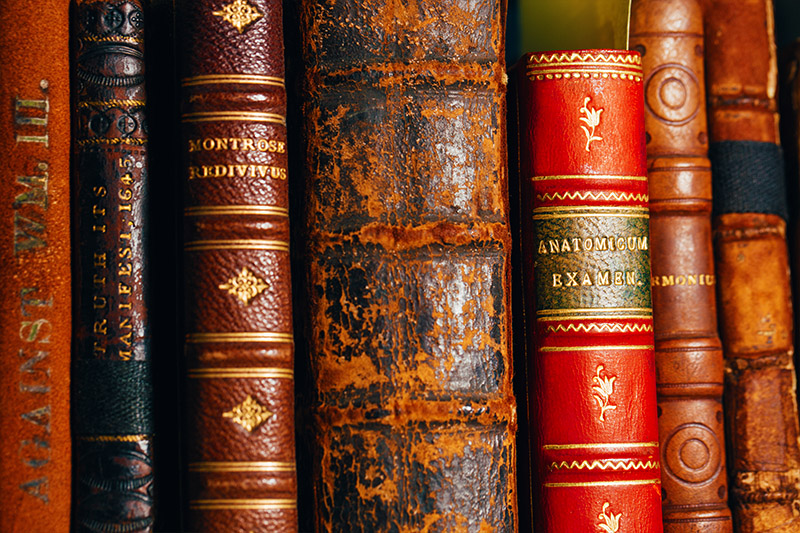
You are a GUI agent. You are given a task and a screenshot of the screen. Output one action in this format:
    pyautogui.click(x=<x>, y=<y>)
    Task: Click on the books
    
    Given the screenshot: What is the action you would take?
    pyautogui.click(x=46, y=359), pyautogui.click(x=113, y=357), pyautogui.click(x=217, y=350), pyautogui.click(x=385, y=344), pyautogui.click(x=572, y=288), pyautogui.click(x=674, y=272), pyautogui.click(x=756, y=270)